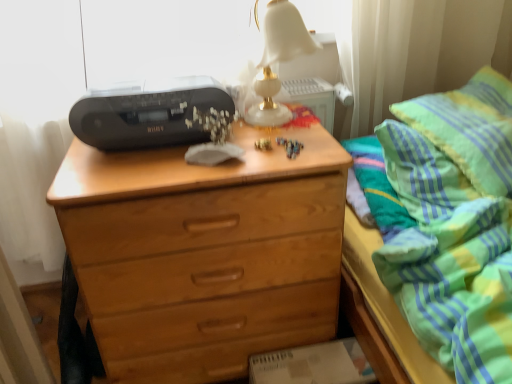
This screenshot has height=384, width=512. In order to click on free space in front of white marble table lamp at upper center in this screenshot , I will do `click(289, 150)`.